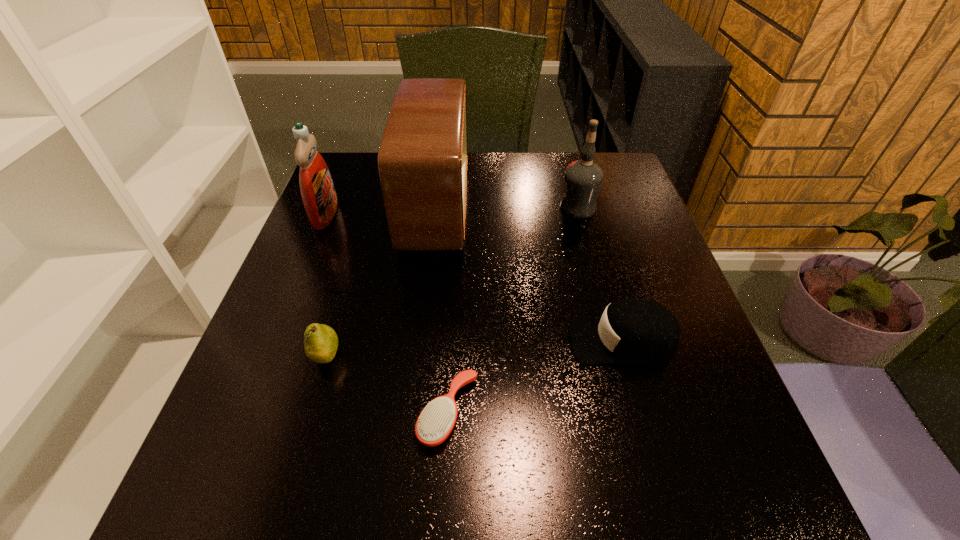
Find the location of a particular element. This screenshot has height=540, width=960. radio receiver is located at coordinates (422, 161).

At what (x,y) coordinates should I click in order to perform the action: click on detergent. Please return your answer as a coordinate pair (x, y). Looking at the image, I should click on (317, 189).

Find the location of a particular element. The height and width of the screenshot is (540, 960). vodka is located at coordinates (583, 178).

The image size is (960, 540). I want to click on the fifth object from right to left, so click(321, 342).

The image size is (960, 540). I want to click on cap, so pos(631,331).

Identify the location of the nearest object. (436, 421).

This screenshot has height=540, width=960. In order to click on hairbrush in this screenshot , I will do click(x=436, y=421).

Where is `vacant space located on the front-facing side of the radio receiver`? vacant space located on the front-facing side of the radio receiver is located at coordinates (593, 208).

The height and width of the screenshot is (540, 960). I want to click on vacant space located 0.130m on the front surface of the leftmost object, so [388, 214].

Find the location of `vacant space positioned 0.130m on the front label of the vodka`. vacant space positioned 0.130m on the front label of the vodka is located at coordinates (510, 208).